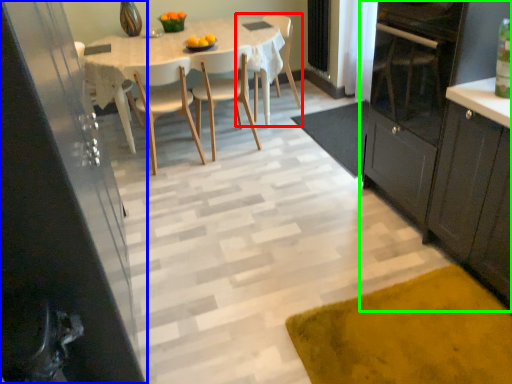
Question: Which is farther away from chair (highlighted by a red box)? cabinetry (highlighted by a blue box) or cabinetry (highlighted by a green box)?

Choices:
 (A) cabinetry
 (B) cabinetry

Answer: (A)